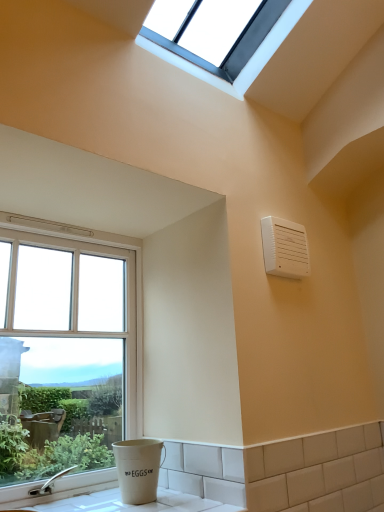
Where is `vacant space situated above clear glass window at left, marked as the 2th window in a top-to-bottom arrangement (from a real-world perspective)`? The image size is (384, 512). vacant space situated above clear glass window at left, marked as the 2th window in a top-to-bottom arrangement (from a real-world perspective) is located at coordinates (75, 224).